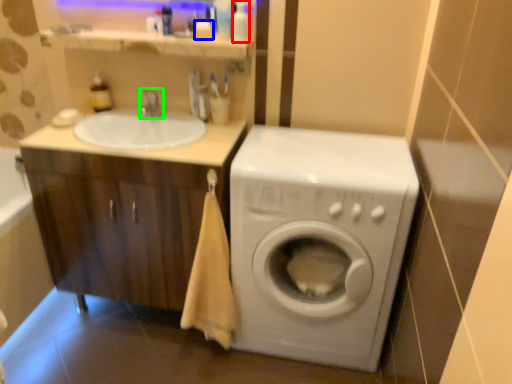
Question: Which object is the closest to the toiletry (highlighted by a red box)? Choose among these: toiletry (highlighted by a blue box) or tap (highlighted by a green box).

Choices:
 (A) toiletry
 (B) tap

Answer: (A)